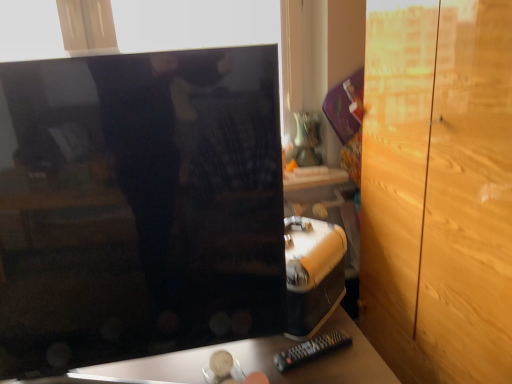
Question: From a real-world perspective, is black plastic remote at lower center below light brown wood dresser at right?

Choices:
 (A) yes
 (B) no

Answer: (A)

Question: Is black plastic remote at lower center wider than light brown wood dresser at right?

Choices:
 (A) yes
 (B) no

Answer: (B)

Question: Is black plastic remote at lower center behind light brown wood dresser at right?

Choices:
 (A) yes
 (B) no

Answer: (A)

Question: From the image's perspective, is black plastic remote at lower center under light brown wood dresser at right?

Choices:
 (A) yes
 (B) no

Answer: (A)

Question: Considering the relative sizes of black plastic remote at lower center and light brown wood dresser at right in the image provided, is black plastic remote at lower center bigger than light brown wood dresser at right?

Choices:
 (A) no
 (B) yes

Answer: (A)

Question: Is glossy black monitor at center wider or thinner than light brown wood dresser at right?

Choices:
 (A) wide
 (B) thin

Answer: (A)

Question: Visually, is glossy black monitor at center positioned to the left or to the right of light brown wood dresser at right?

Choices:
 (A) right
 (B) left

Answer: (B)

Question: Would you say glossy black monitor at center is inside or outside light brown wood dresser at right?

Choices:
 (A) outside
 (B) inside

Answer: (A)

Question: From their relative heights in the image, would you say glossy black monitor at center is taller or shorter than light brown wood dresser at right?

Choices:
 (A) tall
 (B) short

Answer: (B)

Question: Is point (304, 347) positioned closer to the camera than point (501, 21)?

Choices:
 (A) farther
 (B) closer

Answer: (A)

Question: Is black plastic remote at lower center inside the boundaries of light brown wood dresser at right, or outside?

Choices:
 (A) outside
 (B) inside

Answer: (A)

Question: From a real-world perspective, is black plastic remote at lower center above or below light brown wood dresser at right?

Choices:
 (A) above
 (B) below

Answer: (B)

Question: From the image's perspective, relative to light brown wood dresser at right, is black plastic remote at lower center above or below?

Choices:
 (A) below
 (B) above

Answer: (A)

Question: Considering the positions of black plastic remote at lower center and matte black tv at center in the image, is black plastic remote at lower center bigger or smaller than matte black tv at center?

Choices:
 (A) small
 (B) big

Answer: (A)

Question: Visually, is black plastic remote at lower center positioned to the left or to the right of matte black tv at center?

Choices:
 (A) left
 (B) right

Answer: (B)